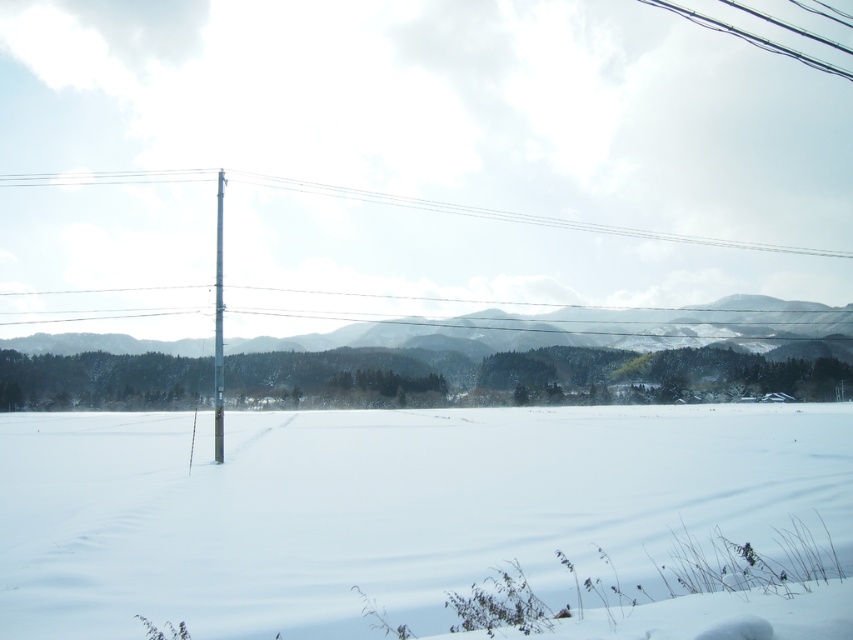
Question: Among these points, which one is farthest from the camera?

Choices:
 (A) (701, 385)
 (B) (218, 349)
 (C) (221, 196)

Answer: (C)

Question: From the image, what is the correct spatial relationship of metallic pole at upper center in relation to metallic silver pole at left?

Choices:
 (A) above
 (B) below

Answer: (A)

Question: Which of the following is the farthest from the observer?

Choices:
 (A) metallic pole at upper center
 (B) metallic gray pole at center-left

Answer: (A)

Question: Is snowy forested mountain at left smaller than metallic pole at upper center?

Choices:
 (A) no
 (B) yes

Answer: (A)

Question: Can you confirm if metallic pole at upper center is positioned to the left of metallic silver pole at left?

Choices:
 (A) yes
 (B) no

Answer: (B)

Question: Which point is closer to the camera taking this photo?

Choices:
 (A) [x=427, y=518]
 (B) [x=216, y=388]
 (C) [x=15, y=356]
 (D) [x=234, y=172]

Answer: (A)